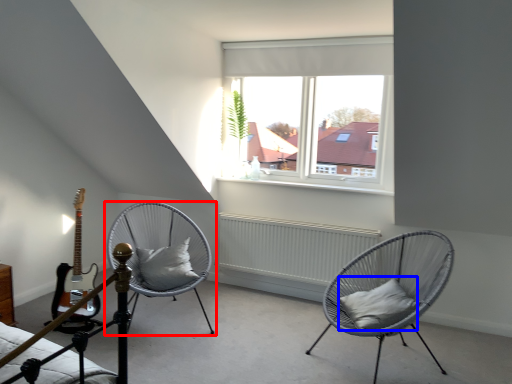
Question: Which point is further to the camera, chair (highlighted by a red box) or pillow (highlighted by a blue box)?

Choices:
 (A) chair
 (B) pillow

Answer: (A)